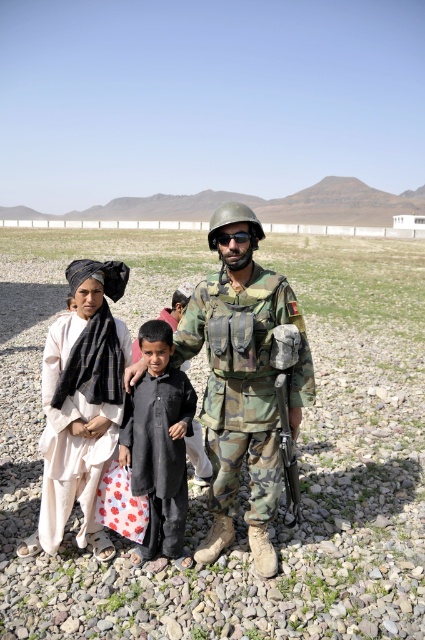
You are a drone operator trying to locate two specific points in a military training area. The first point is at coordinates point (269, 282) and the second point is at point (99, 406). According to the scene, which point is closer to the soldier?

Point (269, 282) is in front of point (99, 406), so it is closer to the soldier.

You are a photographer trying to capture a closeup shot of the black matte goggles at center. You notice the black matte clothing at center is blocking your view. Based on the scene description, can you determine if adjusting your camera angle downward would allow you to see the goggles without the clothing obstructing them?

The black matte clothing at center is larger in size than black matte goggles at center. Since the clothing is larger, adjusting the camera angle downward might help avoid the obstruction caused by the clothing, allowing you to see the goggles.